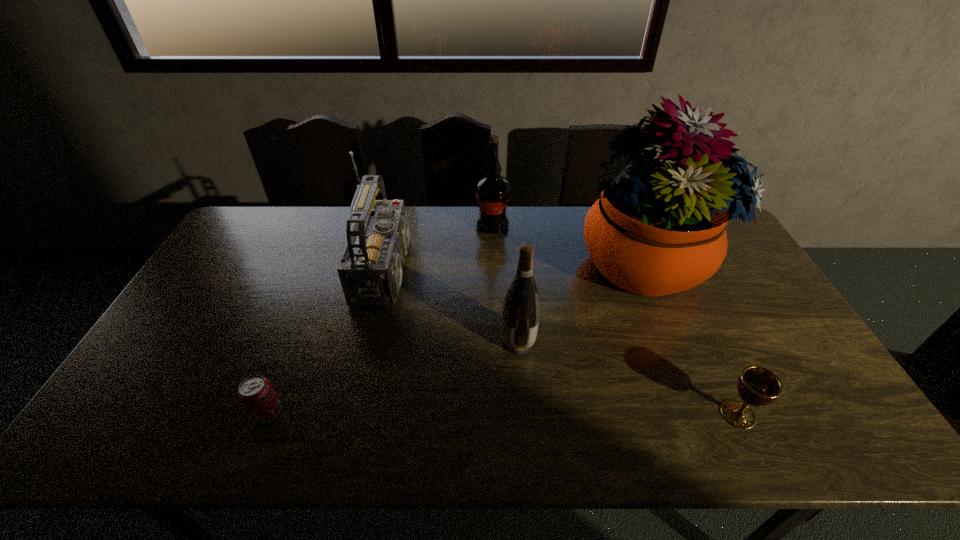
The width and height of the screenshot is (960, 540). In order to click on object positioned at the right edge in this screenshot , I will do `click(658, 228)`.

Where is `object that is at the far right corner`? object that is at the far right corner is located at coordinates (658, 228).

Find the location of a particular element. The image size is (960, 540). free space at the far edge of the desktop is located at coordinates (470, 236).

Find the location of `vacant space at the near edge`. vacant space at the near edge is located at coordinates (509, 421).

Where is `vacant area at the left edge of the desktop`? This screenshot has width=960, height=540. vacant area at the left edge of the desktop is located at coordinates (178, 377).

At what (x,y) coordinates should I click in order to perform the action: click on free space at the right edge of the desktop. Please return your answer as a coordinate pair (x, y). Looking at the image, I should click on (717, 288).

Where is `vacant region at the far left corner`? vacant region at the far left corner is located at coordinates (241, 236).

Identify the location of vacant space at the near right corner of the desktop. The image size is (960, 540). (850, 421).

The width and height of the screenshot is (960, 540). In order to click on free space between the tallest object and the fourth farthest object in this screenshot , I will do `click(580, 302)`.

Find the location of a particular element. This screenshot has height=540, width=960. blank region between the farther wine bottle and the soda is located at coordinates (380, 320).